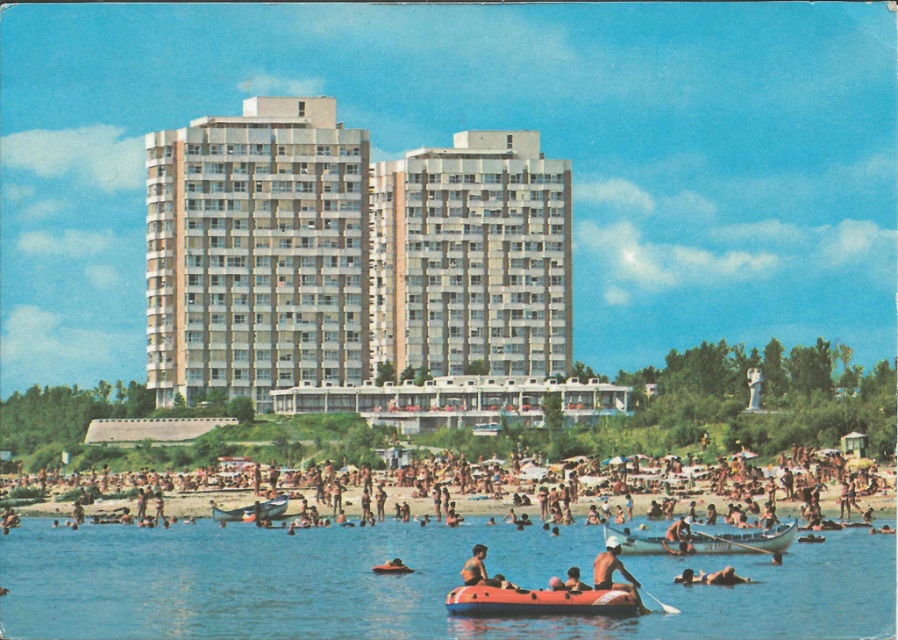
Question: Among these objects, which one is nearest to the camera?

Choices:
 (A) wooden canoe at center
 (B) white plastic canoe at center
 (C) beige concrete building at center

Answer: (B)

Question: Considering the relative positions of beige sand beachgoer at lower center and orange rubber raft at center in the image provided, where is beige sand beachgoer at lower center located with respect to orange rubber raft at center?

Choices:
 (A) above
 (B) below

Answer: (A)

Question: Considering the real-world distances, which object is farthest from the wooden canoe at center?

Choices:
 (A) smooth tan skin at lower center
 (B) translucent blue water at lower center
 (C) white plastic canoe at center
 (D) beige sand beachgoer at lower center

Answer: (A)

Question: Does beige sand beachgoer at lower center appear under smooth tan skin at lower center?

Choices:
 (A) yes
 (B) no

Answer: (B)

Question: Can you confirm if beige sand beachgoer at lower center is positioned to the left of white plastic canoe at center?

Choices:
 (A) no
 (B) yes

Answer: (B)

Question: Which is nearer to the smooth tan skin at lower center?

Choices:
 (A) white plastic canoe at center
 (B) wooden canoe at center
 (C) beige sand beachgoer at lower center

Answer: (A)